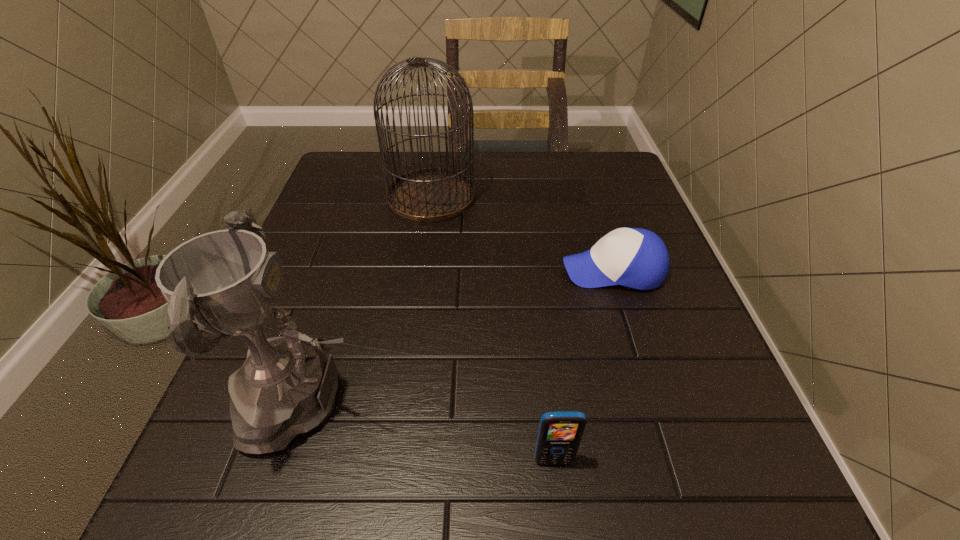
Image resolution: width=960 pixels, height=540 pixels. In order to click on vacant region located 0.050m on the front-facing side of the shortest object in this screenshot , I will do `click(539, 270)`.

You are a GUI agent. You are given a task and a screenshot of the screen. Output one action in this format:
    pyautogui.click(x=<x>, y=<y>)
    Task: Click on the free space located on the front-facing side of the shortest object
    This screenshot has height=540, width=960.
    Given the screenshot: What is the action you would take?
    pyautogui.click(x=524, y=270)

Where is `object situated at the far edge`? object situated at the far edge is located at coordinates (433, 194).

Find the location of `award that is at the near edge`. award that is at the near edge is located at coordinates (225, 282).

The height and width of the screenshot is (540, 960). I want to click on cellular telephone present at the near edge, so click(x=559, y=435).

Where is `object positioned at the left edge`? object positioned at the left edge is located at coordinates (225, 282).

You are a GUI agent. You are given a task and a screenshot of the screen. Output one action in this format:
    pyautogui.click(x=<x>, y=<y>)
    Task: Click on the object positioned at the right edge
    The height and width of the screenshot is (540, 960).
    Given the screenshot: What is the action you would take?
    pyautogui.click(x=637, y=258)

This screenshot has height=540, width=960. I want to click on object present at the near left corner, so click(225, 282).

This screenshot has height=540, width=960. In the image, there is a desktop. Identify the location of vacant space at the far edge. (530, 174).

The image size is (960, 540). I want to click on free space at the near edge, so click(x=392, y=484).